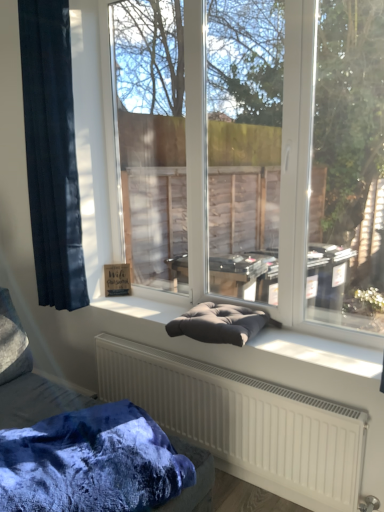
This screenshot has width=384, height=512. Describe the element at coordinates (52, 153) in the screenshot. I see `dark blue fabric at left` at that location.

The height and width of the screenshot is (512, 384). Describe the element at coordinates (91, 463) in the screenshot. I see `velvety blue blanket at lower left` at that location.

This screenshot has height=512, width=384. What do you see at coordinates (39, 399) in the screenshot? I see `velvet cushion at center` at bounding box center [39, 399].

The image size is (384, 512). I want to click on dark gray cushion at center, so click(x=319, y=352).

Is velvety blue blanket at lower left positioned with its back to velvet cushion at center?

Yes, velvety blue blanket at lower left is facing away from velvet cushion at center.

The width and height of the screenshot is (384, 512). I want to click on furniture below the velvety blue blanket at lower left (from a real-world perspective), so click(x=39, y=399).

Is there a large distance between velvety blue blanket at lower left and velvet cushion at center?

velvety blue blanket at lower left is actually quite close to velvet cushion at center.

Considering the sizes of objects velvety blue blanket at lower left and velvet cushion at center in the image provided, who is taller, velvety blue blanket at lower left or velvet cushion at center?

velvet cushion at center.

Between dark blue fabric at left and velvety blue blanket at lower left, which one appears on the left side from the viewer's perspective?

dark blue fabric at left is more to the left.

Based on the photo, considering the sizes of objects dark blue fabric at left and velvety blue blanket at lower left in the image provided, who is shorter, dark blue fabric at left or velvety blue blanket at lower left?

velvety blue blanket at lower left.

From a real-world perspective, is dark blue fabric at left positioned under velvety blue blanket at lower left based on gravity?

Incorrect, from a real-world perspective, dark blue fabric at left is higher than velvety blue blanket at lower left.

Is dark blue fabric at left wider or thinner than velvety blue blanket at lower left?

Considering their sizes, dark blue fabric at left looks slimmer than velvety blue blanket at lower left.

Is dark gray fabric cushion at center next to dark gray cushion at center?

No, dark gray fabric cushion at center is not next to dark gray cushion at center.

Locate an element on the screen. Image resolution: width=384 pixels, height=512 pixels. window sill below the dark gray fabric cushion at center (from a real-world perspective) is located at coordinates (319, 352).

Does dark gray fabric cushion at center have a smaller size compared to dark gray cushion at center?

Incorrect, dark gray fabric cushion at center is not smaller in size than dark gray cushion at center.

Based on the photo, does dark gray fabric cushion at center have a lesser height compared to dark gray cushion at center?

No, dark gray fabric cushion at center is not shorter than dark gray cushion at center.

Are dark blue fabric at left and matte gray cushion at center far apart?

Indeed, dark blue fabric at left is not near matte gray cushion at center.

Could you tell me if dark blue fabric at left is facing matte gray cushion at center?

No, dark blue fabric at left is not aimed at matte gray cushion at center.

Considering the sizes of objects dark blue fabric at left and matte gray cushion at center in the image provided, who is thinner, dark blue fabric at left or matte gray cushion at center?

Thinner between the two is matte gray cushion at center.

Which is closer to the camera, (39, 175) or (224, 98)?

Point (39, 175)

Would you consider velvet cushion at center to be distant from velvety blue blanket at lower left?

velvet cushion at center is actually quite close to velvety blue blanket at lower left.

Which point is more forward, (x=176, y=447) or (x=140, y=499)?

The point (x=140, y=499) is closer to the camera.

Does velvet cushion at center come behind velvety blue blanket at lower left?

No, the depth of velvet cushion at center is less than that of velvety blue blanket at lower left.

In terms of height, does velvet cushion at center look taller or shorter compared to velvety blue blanket at lower left?

Clearly, velvet cushion at center is taller compared to velvety blue blanket at lower left.

Is dark gray cushion at center aimed at dark gray fabric cushion at center?

No, dark gray cushion at center does not turn towards dark gray fabric cushion at center.

Which is in front, dark gray cushion at center or dark gray fabric cushion at center?

dark gray cushion at center is more forward.

Considering the relative sizes of dark gray cushion at center and dark gray fabric cushion at center in the image provided, is dark gray cushion at center smaller than dark gray fabric cushion at center?

Correct, dark gray cushion at center occupies less space than dark gray fabric cushion at center.

Considering the sizes of objects dark gray cushion at center and dark gray fabric cushion at center in the image provided, who is taller, dark gray cushion at center or dark gray fabric cushion at center?

dark gray fabric cushion at center.

Who is smaller, dark gray cushion at center or dark blue fabric at left?

With smaller size is dark gray cushion at center.

Is dark gray cushion at center in front of or behind dark blue fabric at left in the image?

dark gray cushion at center is in front of dark blue fabric at left.

Does dark gray cushion at center turn towards dark blue fabric at left?

No, dark gray cushion at center does not turn towards dark blue fabric at left.

Considering the relative sizes of dark gray cushion at center and dark blue fabric at left in the image provided, is dark gray cushion at center shorter than dark blue fabric at left?

Yes.

Locate an element on the screen. This screenshot has width=384, height=512. furniture in front of the velvety blue blanket at lower left is located at coordinates (39, 399).

Find the location of a particular element. The width and height of the screenshot is (384, 512). curtain positioned vertically above the velvety blue blanket at lower left (from a real-world perspective) is located at coordinates (52, 153).

Estimate the real-world distances between objects in this image. Which object is further from dark gray cushion at center, velvety blue blanket at lower left or matte gray cushion at center?

matte gray cushion at center lies further to dark gray cushion at center than the other object.

Looking at this image, based on their spatial positions, is matte gray cushion at center or velvet cushion at center further from dark gray fabric cushion at center?

matte gray cushion at center is positioned further to the anchor dark gray fabric cushion at center.

Looking at the image, which one is located further to velvet cushion at center, velvety blue blanket at lower left or dark gray fabric cushion at center?

Among the two, dark gray fabric cushion at center is located further to velvet cushion at center.

Estimate the real-world distances between objects in this image. Which object is further from dark gray fabric cushion at center, velvety blue blanket at lower left or dark gray cushion at center?

velvety blue blanket at lower left lies further to dark gray fabric cushion at center than the other object.

Estimate the real-world distances between objects in this image. Which object is further from velvety blue blanket at lower left, matte gray cushion at center or dark gray cushion at center?

matte gray cushion at center is further to velvety blue blanket at lower left.

When comparing their distances from dark gray cushion at center, does velvety blue blanket at lower left or velvet cushion at center seem closer?

Among the two, velvety blue blanket at lower left is located nearer to dark gray cushion at center.

Based on the photo, when comparing their distances from velvety blue blanket at lower left, does dark blue fabric at left or velvet cushion at center seem closer?

The object closer to velvety blue blanket at lower left is velvet cushion at center.

Estimate the real-world distances between objects in this image. Which object is closer to dark gray fabric cushion at center, velvet cushion at center or dark blue fabric at left?

velvet cushion at center is positioned closer to the anchor dark gray fabric cushion at center.

Where is `window sill between dark blue fabric at left and velvet cushion at center vertically`? Image resolution: width=384 pixels, height=512 pixels. window sill between dark blue fabric at left and velvet cushion at center vertically is located at coordinates (319, 352).

Image resolution: width=384 pixels, height=512 pixels. Find the location of `blanket located between velvet cushion at center and dark gray fabric cushion at center in the depth direction`. blanket located between velvet cushion at center and dark gray fabric cushion at center in the depth direction is located at coordinates (91, 463).

At what (x,y) coordinates should I click in order to perform the action: click on material that lies between matte gray cushion at center and dark gray cushion at center from top to bottom. Please return your answer as a coordinate pair (x, y). This screenshot has width=384, height=512. Looking at the image, I should click on (219, 323).

You are a GUI agent. You are given a task and a screenshot of the screen. Output one action in this format:
    pyautogui.click(x=<x>, y=<y>)
    Task: Click on the window sill between dark blue fabric at left and dark gray fabric cushion at center in the horizontal direction
    
    Given the screenshot: What is the action you would take?
    pyautogui.click(x=319, y=352)